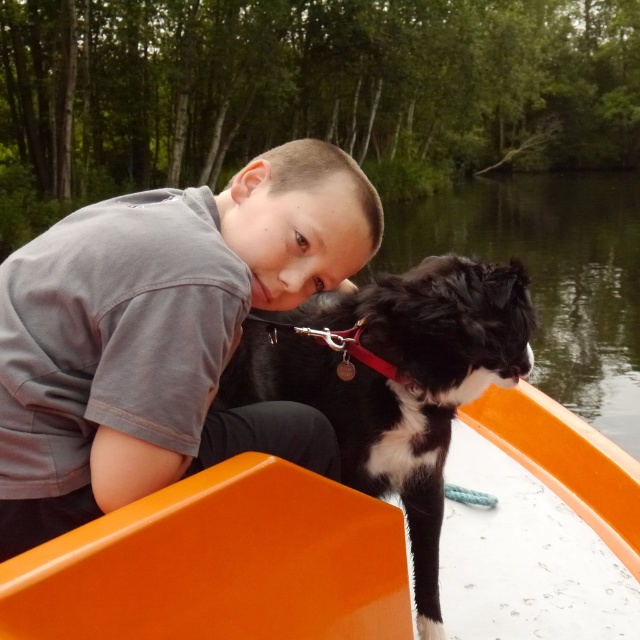
Does gray cotton shirt at upper left appear on the left side of black and white fur dog at center?

Yes, gray cotton shirt at upper left is to the left of black and white fur dog at center.

Who is more forward, (26, 522) or (476, 292)?

Point (26, 522)

Image resolution: width=640 pixels, height=640 pixels. Identify the location of gray cotton shirt at upper left. (161, 333).

Can you confirm if orange plastic boat at center is positioned to the left of black and white fur dog at center?

Incorrect, orange plastic boat at center is not on the left side of black and white fur dog at center.

Is orange plastic boat at center smaller than black and white fur dog at center?

Yes.

Who is more distant from viewer, [552,490] or [522,321]?

Point [552,490]

The width and height of the screenshot is (640, 640). In order to click on orange plastic boat at center in this screenshot , I will do `click(220, 564)`.

Who is higher up, gray cotton shirt at upper left or orange plastic boat at center?

gray cotton shirt at upper left is higher up.

This screenshot has width=640, height=640. What do you see at coordinates (161, 333) in the screenshot?
I see `gray cotton shirt at upper left` at bounding box center [161, 333].

Which is in front, point (269, 305) or point (244, 600)?

Positioned in front is point (244, 600).

Where is `gray cotton shirt at upper left`? gray cotton shirt at upper left is located at coordinates (161, 333).